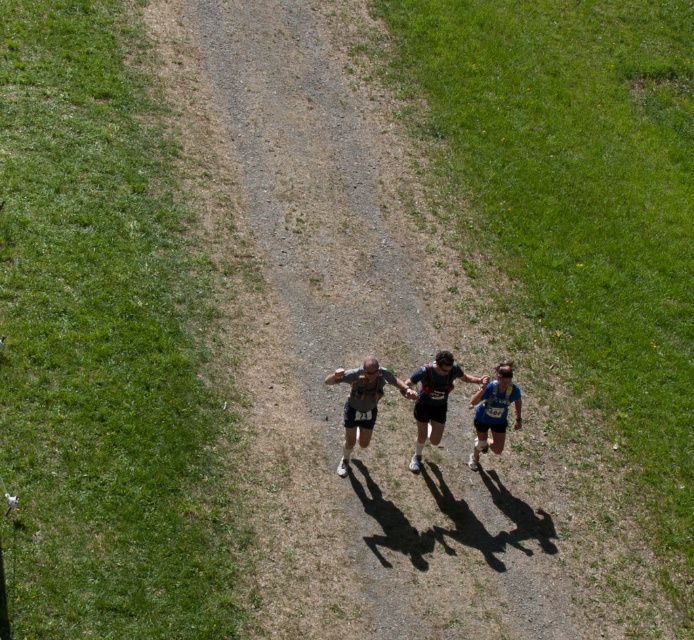
You are a photographer trying to capture a photo of the runners. You notice the black fabric running suit at center and the blue fabric runner at center. Which runner should you focus on to ensure the subject fills the frame better?

The black fabric running suit at center is bigger than the blue fabric runner at center, so focusing on the black fabric running suit at center will fill the frame better.

You are a photographer standing on the side of the path. You want to take a photo of the runners while ensuring they are all in focus. The camera you are using has a depth of field that can sharply focus on objects within a 1.5 meter range. Given the distance between the matte gray tank top at center and the blue fabric runner at center, will both runners be in focus in the photo?

The matte gray tank top at center and blue fabric runner at center are 1.26 meters apart, which is within the camera s 1.5 meter depth of field range. Therefore, both runners will be in focus in the photo.

In the scene shown: You are a photographer positioned on the dirt path. You want to capture both the black fabric running suit at center and the blue fabric runner at center in a single shot without moving your camera. Can you fit both in your frame if your camera has a maximum horizontal field of view of 18 inches?

The black fabric running suit at center and blue fabric runner at center are 18.78 inches apart from each other. Since the distance between them exceeds the camera field of view of 18 inches, you cannot fit both in the frame without moving the camera.